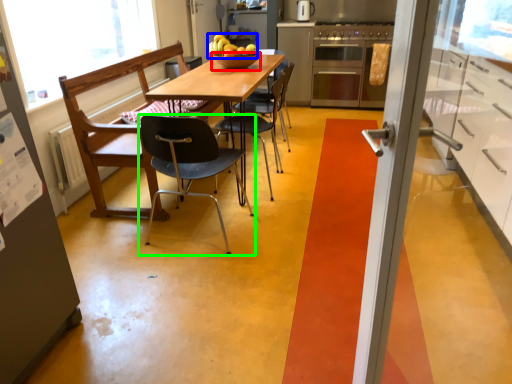
Question: Based on their relative distances, which object is nearer to bowl (highlighted by a red box)? Choose from fruit (highlighted by a blue box) and chair (highlighted by a green box).

Choices:
 (A) fruit
 (B) chair

Answer: (A)